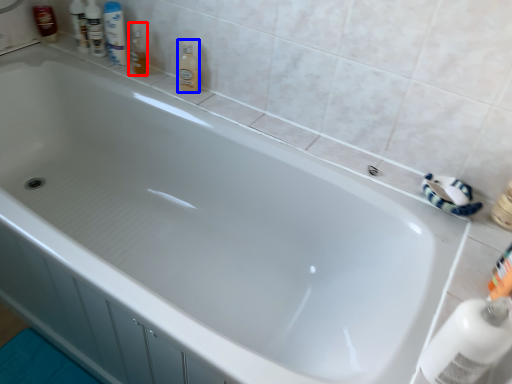
Question: Among these objects, which one is nearest to the camera, toiletry (highlighted by a red box) or cleaning product (highlighted by a blue box)?

Choices:
 (A) toiletry
 (B) cleaning product

Answer: (B)